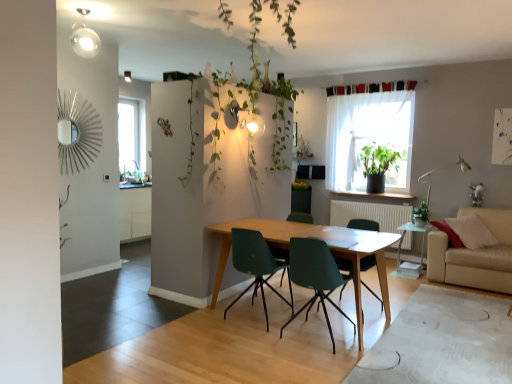
Question: Visually, is matte green plastic chair at center, which is the fourth chair from right to left, positioned to the left or to the right of teal plastic chair at center, acting as the third chair starting from the left?

Choices:
 (A) right
 (B) left

Answer: (B)

Question: From their relative heights in the image, would you say matte green plastic chair at center, placed as the first chair when sorted from left to right, is taller or shorter than teal plastic chair at center, which is the 2th chair from right to left?

Choices:
 (A) tall
 (B) short

Answer: (B)

Question: Which object is the closest to the wooden table at center?

Choices:
 (A) transparent glass window at upper left, placed as the second window when sorted from right to left
 (B) transparent glass side table at lower right
 (C) matte green chair at center, positioned as the first chair in right-to-left order
 (D) teal plastic chair at center, acting as the third chair starting from the left
 (E) matte green chair at center, placed as the 3th chair when sorted from right to left

Answer: (C)

Question: Considering the real-world distances, which object is farthest from the green matte plant at window?

Choices:
 (A) transparent glass window at upper left, placed as the second window when sorted from right to left
 (B) green leafy plant at right
 (C) white matte radiator at center
 (D) transparent glass side table at lower right
 (E) matte green chair at center, placed as the 3th chair when sorted from right to left

Answer: (A)